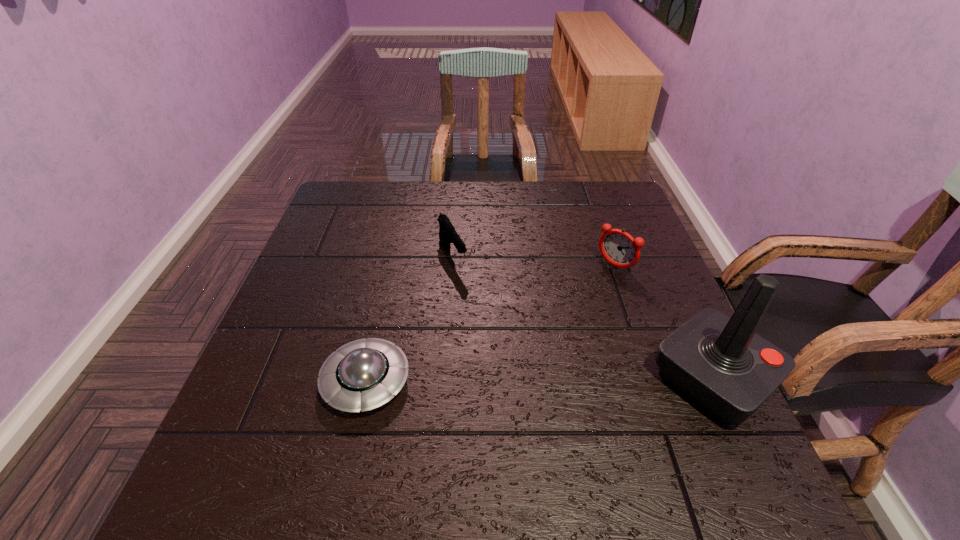
Identify the location of vacant space in between the tallest object and the alarm clock. Image resolution: width=960 pixels, height=540 pixels. (663, 322).

Where is `empty location between the joystick and the alarm clock`? Image resolution: width=960 pixels, height=540 pixels. empty location between the joystick and the alarm clock is located at coordinates (663, 322).

The image size is (960, 540). Identify the location of free point between the leftmost object and the third object from right to left. (409, 318).

You are a GUI agent. You are given a task and a screenshot of the screen. Output one action in this format:
    pyautogui.click(x=<x>, y=<y>)
    Task: Click on the free space between the third tallest object and the shortest object
    Image resolution: width=960 pixels, height=540 pixels.
    Given the screenshot: What is the action you would take?
    pyautogui.click(x=409, y=318)

Where is `free space that is in between the saucer and the alarm clock`? free space that is in between the saucer and the alarm clock is located at coordinates (491, 323).

Identify the location of unoccupied area between the tallest object and the alarm clock. This screenshot has width=960, height=540. (663, 322).

Locate which object ranks second in proximity to the third tallest object. Please provide its 2D coordinates. Your answer should be formatted as a tuple, i.e. [(x, y)], where the tuple contains the x and y coordinates of a point satisfying the conditions above.

[(617, 247)]

Identify the location of object that is the second closest to the tallest object. (447, 234).